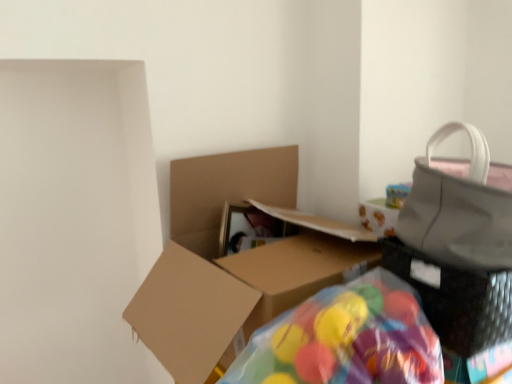
Question: Is matte gray handbag at right not inside translucent plastic bean bag chair at lower center?

Choices:
 (A) yes
 (B) no

Answer: (A)

Question: Is matte gray handbag at right bigger than translucent plastic bean bag chair at lower center?

Choices:
 (A) no
 (B) yes

Answer: (B)

Question: Would you say translucent plastic bean bag chair at lower center is part of matte gray handbag at right's contents?

Choices:
 (A) no
 (B) yes

Answer: (A)

Question: Does matte gray handbag at right have a lesser height compared to translucent plastic bean bag chair at lower center?

Choices:
 (A) yes
 (B) no

Answer: (B)

Question: From a real-world perspective, is matte gray handbag at right physically above translucent plastic bean bag chair at lower center?

Choices:
 (A) yes
 (B) no

Answer: (A)

Question: Considering the relative sizes of matte gray handbag at right and translucent plastic bean bag chair at lower center in the image provided, is matte gray handbag at right taller than translucent plastic bean bag chair at lower center?

Choices:
 (A) yes
 (B) no

Answer: (A)

Question: Can you confirm if translucent plastic bean bag chair at lower center is wider than brown cardboard box at center?

Choices:
 (A) no
 (B) yes

Answer: (A)

Question: From a real-world perspective, is translucent plastic bean bag chair at lower center located beneath brown cardboard box at center?

Choices:
 (A) yes
 (B) no

Answer: (A)

Question: Is translucent plastic bean bag chair at lower center positioned in front of brown cardboard box at center?

Choices:
 (A) no
 (B) yes

Answer: (B)

Question: Is brown cardboard box at center a part of translucent plastic bean bag chair at lower center?

Choices:
 (A) no
 (B) yes

Answer: (A)

Question: From a real-world perspective, is translucent plastic bean bag chair at lower center on top of brown cardboard box at center?

Choices:
 (A) yes
 (B) no

Answer: (B)

Question: From the image's perspective, does translucent plastic bean bag chair at lower center appear lower than brown cardboard box at center?

Choices:
 (A) yes
 (B) no

Answer: (A)

Question: Is matte gray handbag at right thinner than brown cardboard box at center?

Choices:
 (A) no
 (B) yes

Answer: (B)